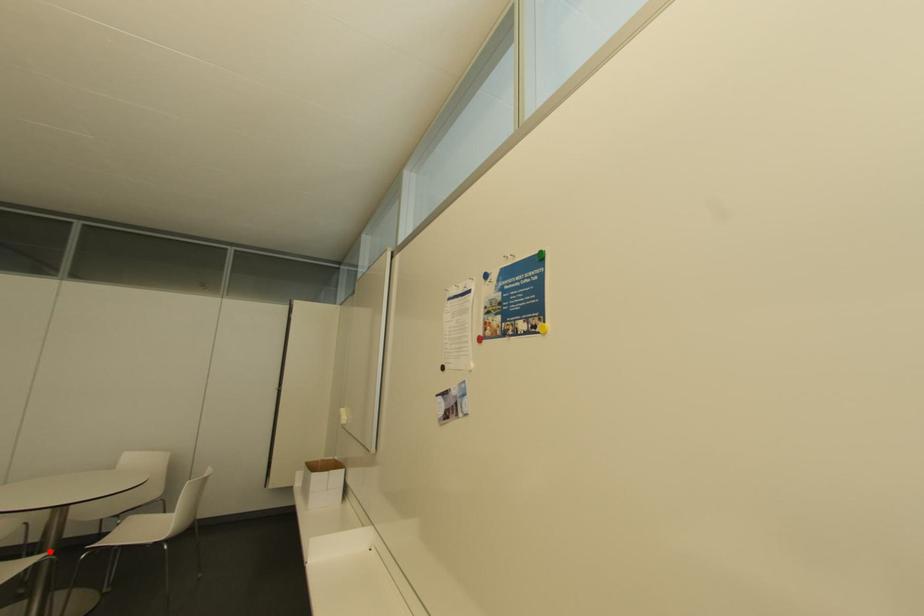
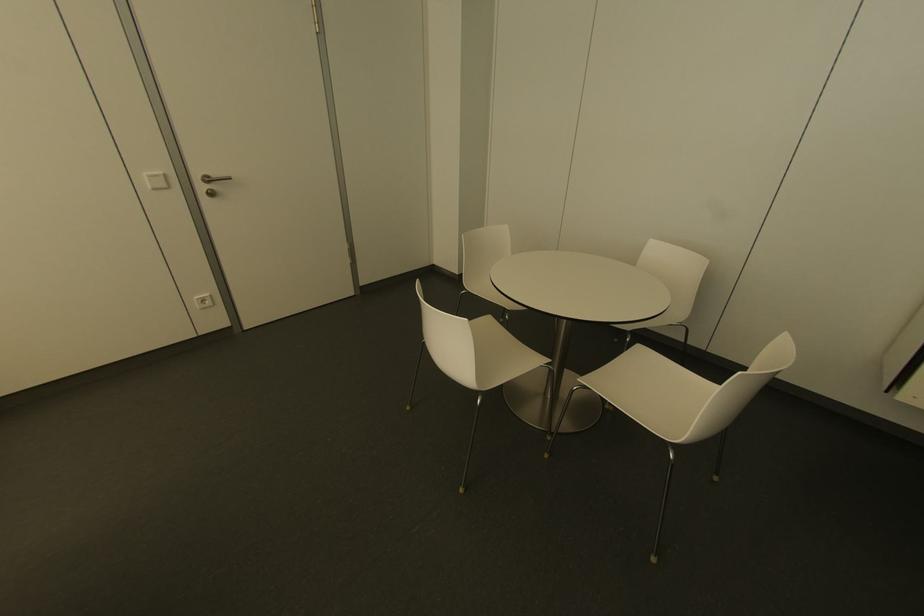
Locate, in the second image, the point that corresponds to the highlighted location in the first image.

(546, 361)